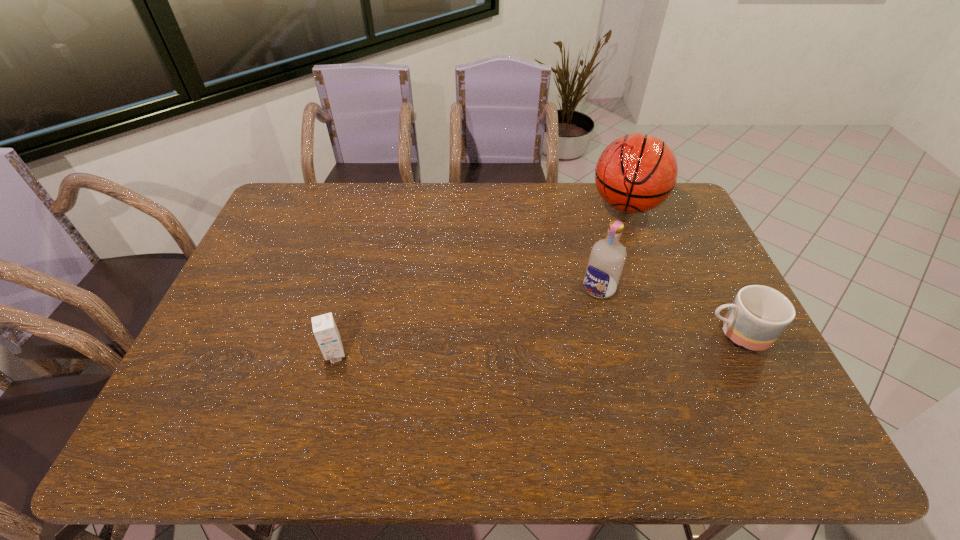
The image size is (960, 540). Identify the location of the leftmost object. (325, 330).

The height and width of the screenshot is (540, 960). What are the coordinates of `mug` in the screenshot? It's located at (758, 315).

I want to click on the farthest object, so click(637, 172).

Locate an element on the screen. Image resolution: width=960 pixels, height=540 pixels. the third nearest object is located at coordinates (607, 257).

Locate an element on the screen. This screenshot has height=540, width=960. free space located 0.140m on the left of the leftmost object is located at coordinates coord(270,355).

Locate an element on the screen. This screenshot has height=540, width=960. blank space located 0.210m on the side with the handle of the mug is located at coordinates [x=625, y=334].

Where is `free region located on the side with the handle of the mug`? This screenshot has height=540, width=960. free region located on the side with the handle of the mug is located at coordinates (569, 334).

The image size is (960, 540). Identify the location of vacant space located on the side with the handle of the mug. coord(573,334).

I want to click on vacant region located 0.330m on the side with spill of the basketball, so click(580, 288).

This screenshot has width=960, height=540. Find the location of `vacant space located 0.240m on the side with spill of the basketball`. vacant space located 0.240m on the side with spill of the basketball is located at coordinates (590, 269).